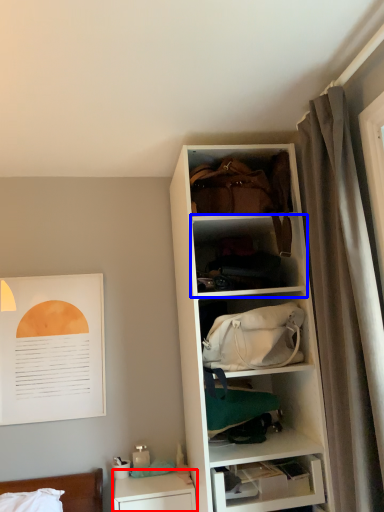
Question: Which point is further to the camera, table (highlighted by a red box) or shelf (highlighted by a blue box)?

Choices:
 (A) table
 (B) shelf

Answer: (A)